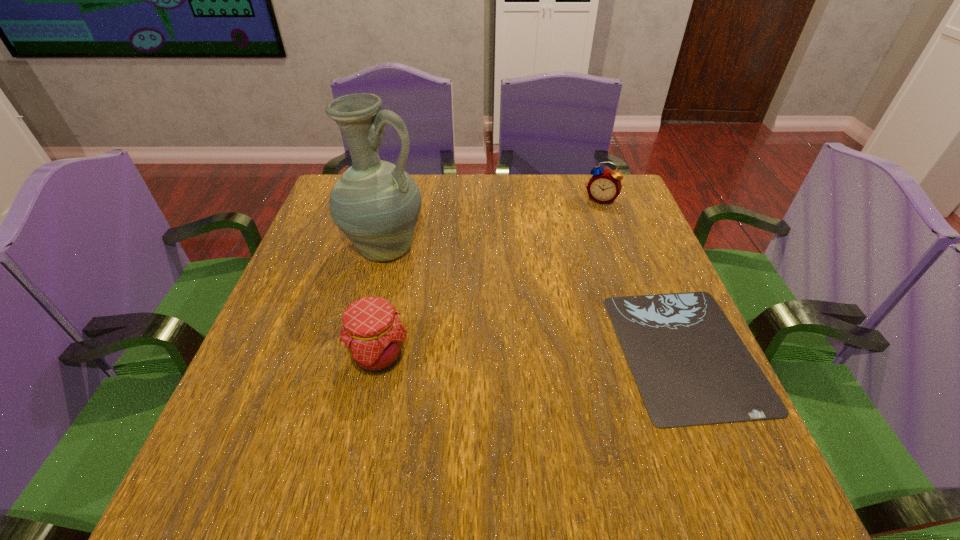
Where is `vacant space positioned 0.090m on the front-facing side of the farthest object`? vacant space positioned 0.090m on the front-facing side of the farthest object is located at coordinates (590, 225).

Where is `free region located on the front-facing side of the farthest object`? This screenshot has height=540, width=960. free region located on the front-facing side of the farthest object is located at coordinates (585, 240).

Find the location of `vacant space located 0.180m on the front-facing side of the farthest object`. vacant space located 0.180m on the front-facing side of the farthest object is located at coordinates (584, 245).

This screenshot has height=540, width=960. In order to click on object that is positioned at the far edge in this screenshot , I will do `click(604, 186)`.

Image resolution: width=960 pixels, height=540 pixels. In order to click on object that is at the near edge in this screenshot , I will do `click(691, 368)`.

Find the location of a particular element. The height and width of the screenshot is (540, 960). object located in the left edge section of the desktop is located at coordinates (375, 203).

You are a GUI agent. You are given a task and a screenshot of the screen. Output one action in this format:
    pyautogui.click(x=<x>, y=<y>)
    Task: Click on the mousepad that is positioned at the right edge
    This screenshot has width=960, height=540.
    Given the screenshot: What is the action you would take?
    pyautogui.click(x=691, y=368)

Where is `alarm clock that is at the right edge`? The height and width of the screenshot is (540, 960). alarm clock that is at the right edge is located at coordinates (604, 186).

In order to click on object at the far right corner in this screenshot , I will do pos(604,186).

Identify the location of object at the near right corner. This screenshot has width=960, height=540. (691, 368).